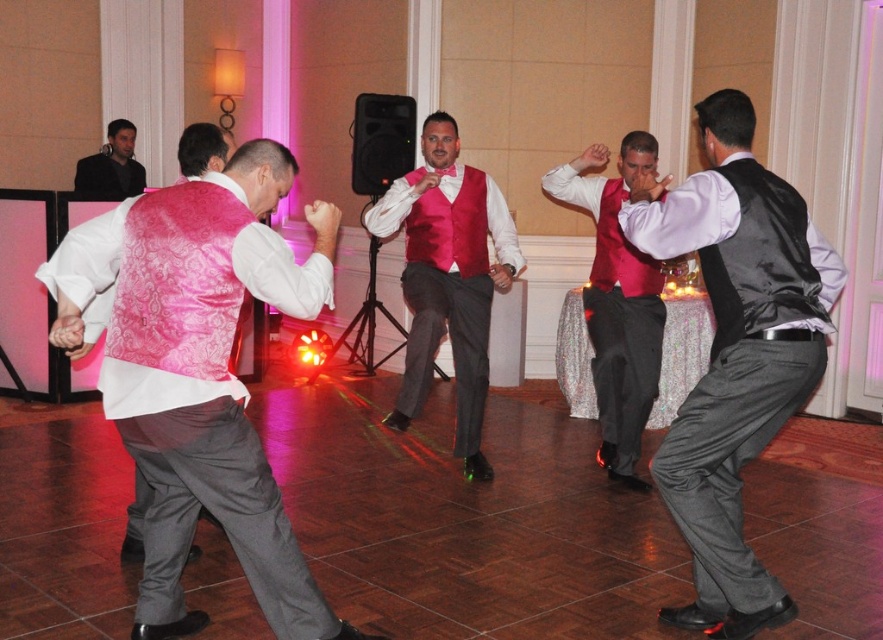
You are a photographer at this event and need to capture a photo that includes both the shiny red vest at center and the black fabric jacket at upper left. Given their positions, where should you position yourself to ensure both are in frame?

You should position yourself below both the shiny red vest at center and the black fabric jacket at upper left to capture both in the frame since the shiny red vest at center is located below the black fabric jacket at upper left.

You are a photographer at the event and want to capture both the pink satin vest at left and the matte red vest at center in a single photo. Since you can only focus on one subject at a time, which vest should you focus on to ensure both are in focus?

You should focus on the matte red vest at center because the pink satin vest at left is closer to the viewer, and focusing on the farther object allows both to be in focus through depth of field.

You are a photographer at the event and want to capture a photo of both the pink satin vest at left and the matte red vest at center in the same frame. Based on their positions, which vest should you focus on first to ensure both are in the shot?

The pink satin vest at left is to the left of the matte red vest at center, so you should focus on the pink satin vest at left first to ensure both are in the shot.